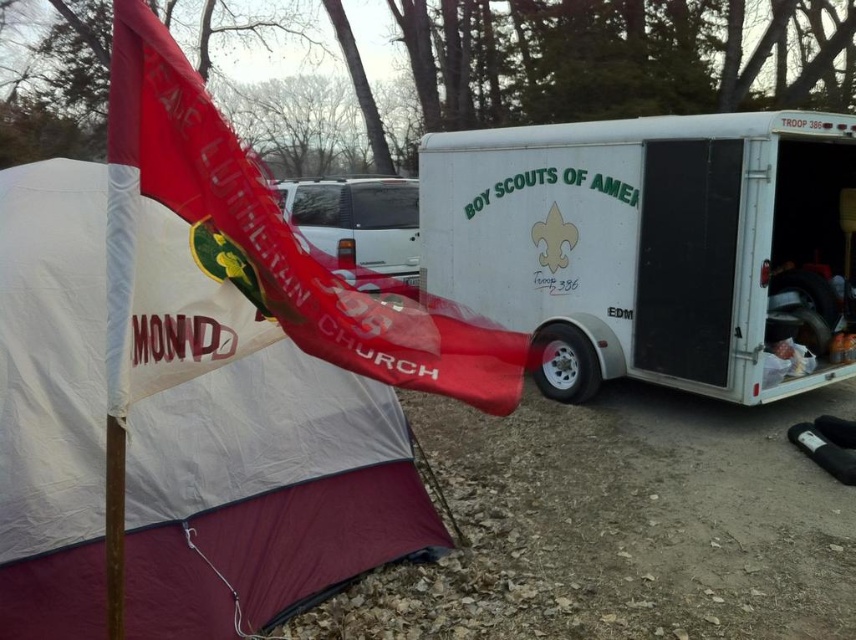
Is the position of white matte trailer at right more distant than that of red fabric flag at upper left?

That is True.

I want to click on white matte trailer at right, so click(x=651, y=244).

Who is shorter, white nylon tent at left or white matte trailer at right?

white nylon tent at left is shorter.

Is point (86, 436) positioned after point (755, 296)?

That is False.

This screenshot has height=640, width=856. What are the coordinates of `white nylon tent at left` in the screenshot? It's located at (251, 464).

Identify the location of white nylon tent at left. The height and width of the screenshot is (640, 856). (251, 464).

Looking at this image, is white nylon tent at left behind red fabric flag at upper left?

Yes, white nylon tent at left is behind red fabric flag at upper left.

Is point (331, 449) farther from camera compared to point (123, 346)?

Yes, it is behind point (123, 346).

At what (x,y) coordinates should I click in order to perform the action: click on white nylon tent at left. Please return your answer as a coordinate pair (x, y). The image size is (856, 640). Looking at the image, I should click on (251, 464).